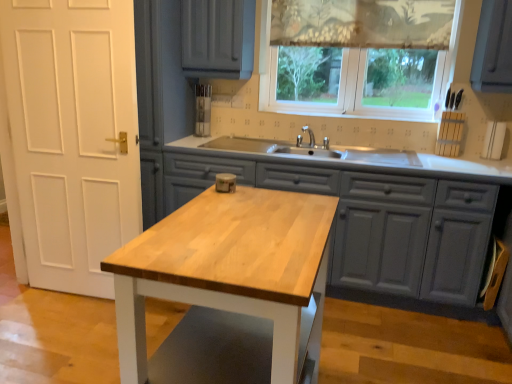
Question: From a real-world perspective, is patterned fabric curtain at upper center positioned under wooden island at center based on gravity?

Choices:
 (A) no
 (B) yes

Answer: (A)

Question: From a real-world perspective, is patterned fabric curtain at upper center positioned over wooden island at center based on gravity?

Choices:
 (A) no
 (B) yes

Answer: (B)

Question: From the image's perspective, is patterned fabric curtain at upper center on top of wooden island at center?

Choices:
 (A) yes
 (B) no

Answer: (A)

Question: Does patterned fabric curtain at upper center come in front of wooden island at center?

Choices:
 (A) no
 (B) yes

Answer: (A)

Question: Considering the relative sizes of patterned fabric curtain at upper center and wooden island at center in the image provided, is patterned fabric curtain at upper center wider than wooden island at center?

Choices:
 (A) yes
 (B) no

Answer: (B)

Question: Does patterned fabric curtain at upper center turn towards wooden island at center?

Choices:
 (A) yes
 (B) no

Answer: (B)

Question: Is patterned fabric curtain at upper center positioned behind light wood table at center?

Choices:
 (A) no
 (B) yes

Answer: (B)

Question: From a real-world perspective, is patterned fabric curtain at upper center located beneath light wood table at center?

Choices:
 (A) no
 (B) yes

Answer: (A)

Question: Does patterned fabric curtain at upper center have a lesser width compared to light wood table at center?

Choices:
 (A) no
 (B) yes

Answer: (B)

Question: Can you confirm if patterned fabric curtain at upper center is bigger than light wood table at center?

Choices:
 (A) yes
 (B) no

Answer: (B)

Question: Is patterned fabric curtain at upper center facing away from light wood table at center?

Choices:
 (A) no
 (B) yes

Answer: (A)

Question: Does patterned fabric curtain at upper center have a lesser height compared to light wood table at center?

Choices:
 (A) no
 (B) yes

Answer: (B)

Question: From a real-world perspective, is translucent fabric at upper center positioned under patterned fabric curtain at upper center based on gravity?

Choices:
 (A) yes
 (B) no

Answer: (A)